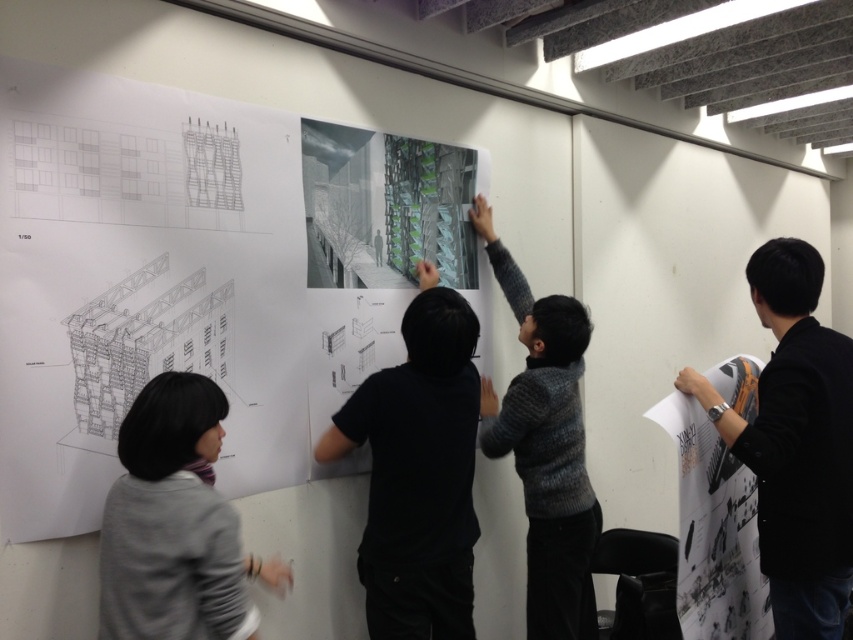
You are standing 2 meters away from a wall with architectural drawings. You see a person wearing a black matte shirt at center. Can you reach the wall without moving closer than 1.97 meters from the person?

The black matte shirt at center and viewer are 1.97 meters apart. Since you are standing 2 meters away from the wall, which is slightly further than 1.97 meters, you can reach the wall without moving closer than 1.97 meters from the person.